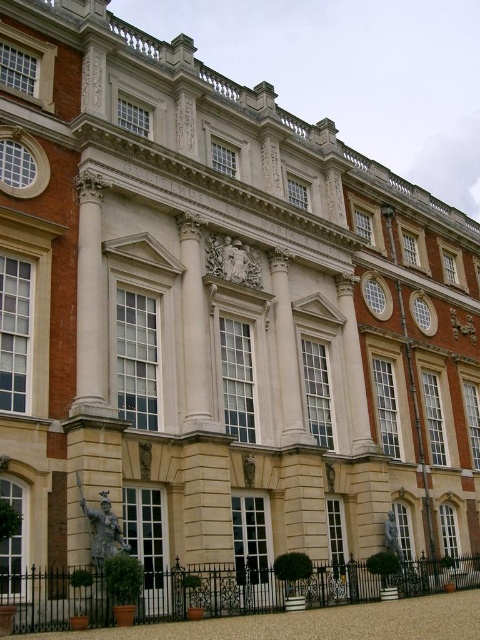
In the scene shown: You are an art student examining the classical building facade. You notice two bronze statues. The first is the bronze statue at center, and the second is the bronze statue at lower center. From your vantage point, which bronze statue is located to the right of the other?

The bronze statue at center is positioned on the left side of bronze statue at lower center, so the bronze statue at lower center is to the right of the bronze statue at center.

What is located at the coordinates point [103,529] in the image?

A bronze statue at center is located at point [103,529] in the image.

You are standing in front of the classical building and want to locate the bronze statue at center. According to the coordinates provided, where should you look to find it?

The bronze statue at center is located at coordinates point (103,529), so you should look towards the upper central area of the building facade.